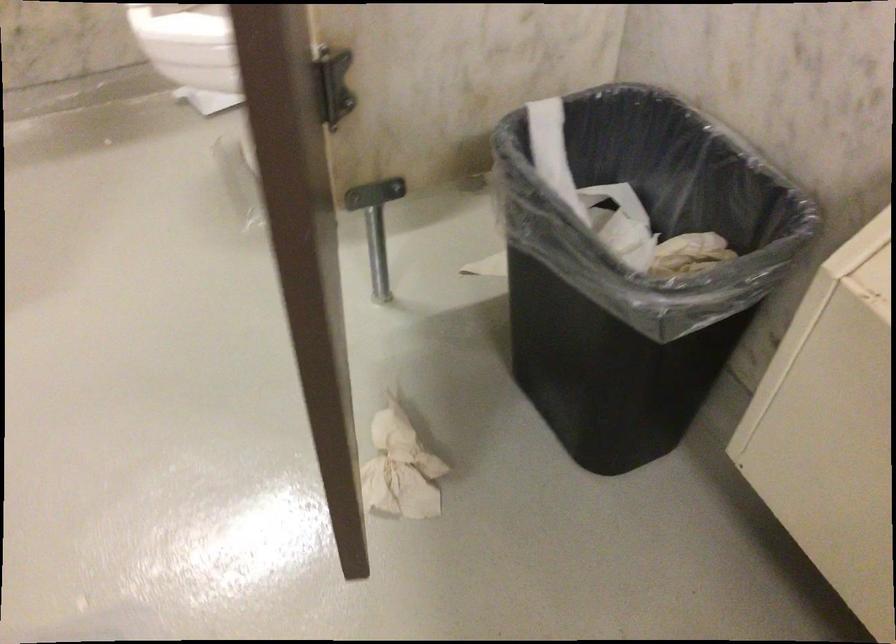
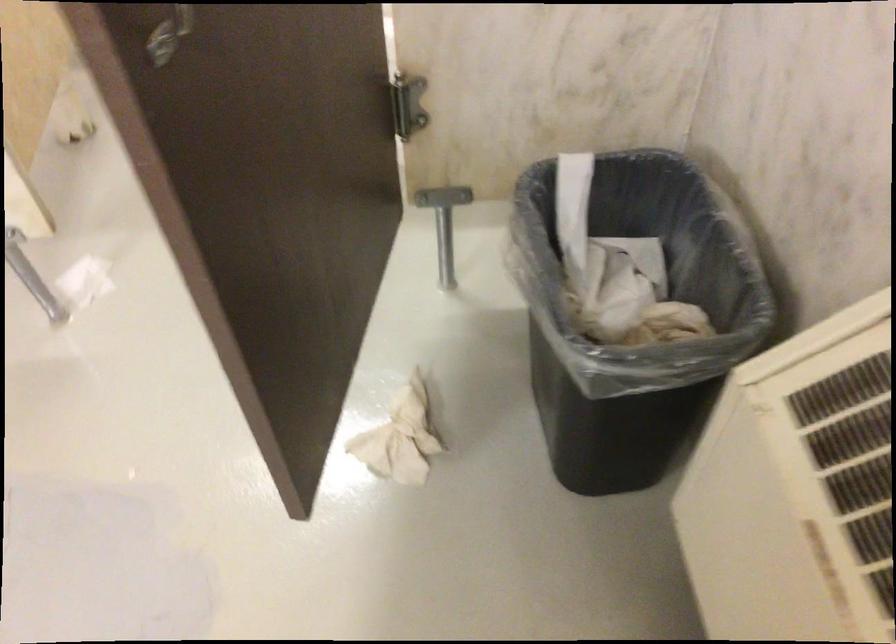
Where in the second image is the point corresponding to the point at 403,468 from the first image?

(400, 438)